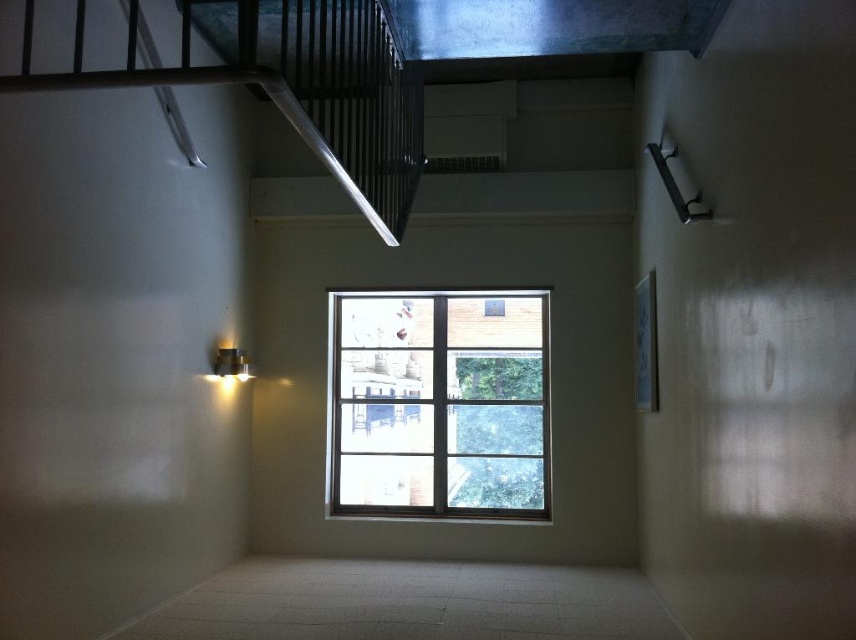
Question: Which point is closer to the camera?

Choices:
 (A) metallic silver stair at upper left
 (B) matte silver light fixture at left

Answer: (A)

Question: Among these objects, which one is farthest from the camera?

Choices:
 (A) clear glass window at center
 (B) metallic silver stair at upper left
 (C) matte silver light fixture at left

Answer: (A)

Question: Is clear glass window at center closer to the viewer compared to metallic silver stair at upper left?

Choices:
 (A) no
 (B) yes

Answer: (A)

Question: Can you confirm if metallic silver stair at upper left is positioned above matte silver light fixture at left?

Choices:
 (A) no
 (B) yes

Answer: (B)

Question: Does clear glass window at center appear on the left side of matte silver light fixture at left?

Choices:
 (A) yes
 (B) no

Answer: (B)

Question: Which of the following is the closest to the observer?

Choices:
 (A) clear glass window at center
 (B) metallic silver stair at upper left
 (C) matte silver light fixture at left

Answer: (B)